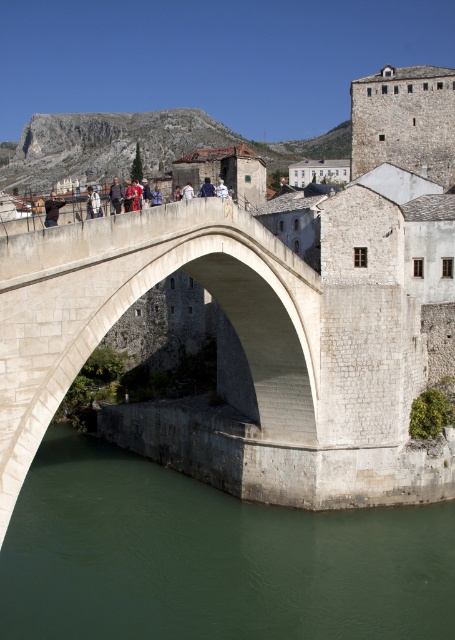
Question: Among these points, which one is farthest from the camera?

Choices:
 (A) coord(111,189)
 (B) coord(198,193)
 (C) coord(146,280)

Answer: (B)

Question: Estimate the real-world distances between objects in this image. Which object is farther from the light brown leather jacket at center?

Choices:
 (A) white stone arch bridge at center
 (B) dark blue jeans at center
 (C) dark brown leather jacket at center

Answer: (B)

Question: Which point is closer to the camera?

Choices:
 (A) dark brown leather jacket at center
 (B) blue fabric shirt at center
 (C) green stone water at lower center
 (D) dark blue jeans at center

Answer: (C)

Question: Is green stone water at lower center below light brown leather jacket at center?

Choices:
 (A) no
 (B) yes

Answer: (B)

Question: In this image, where is green stone water at lower center located relative to dark brown leather jacket at center?

Choices:
 (A) right
 (B) left

Answer: (A)

Question: Observing the image, what is the correct spatial positioning of light brown leather jacket at center in reference to dark blue jeans at center?

Choices:
 (A) right
 (B) left

Answer: (A)